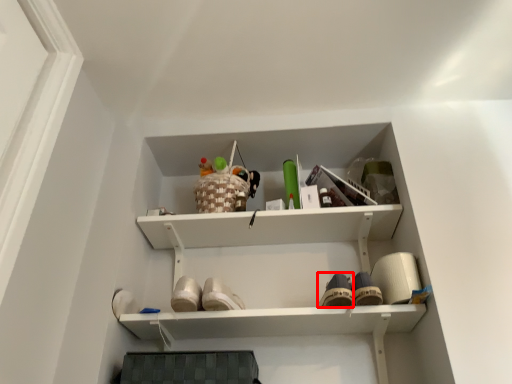
Question: From the image's perspective, what is the correct spatial positioning of shoe (annotated by the red box) in reference to toy?

Choices:
 (A) above
 (B) below

Answer: (B)